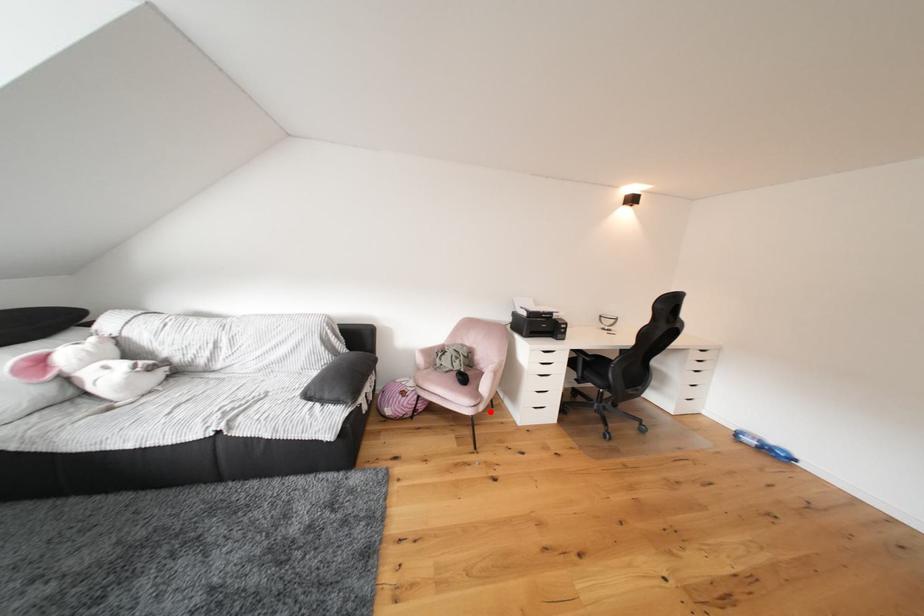
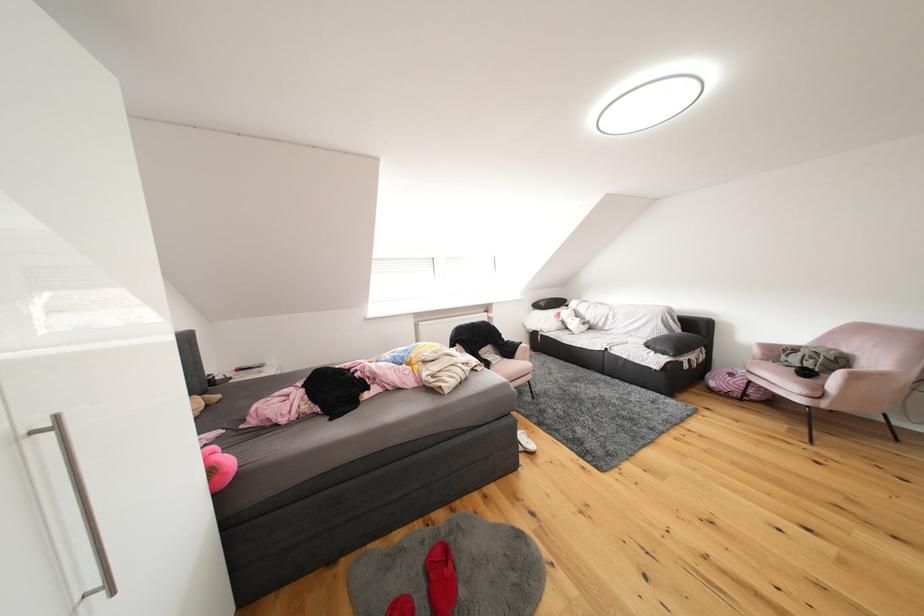
Question: I am providing you with two images of the same scene from different viewpoints. Image1 has a red point marked. In image2, the corresponding 3D location appears at what relative position? Reply with the corresponding letter.

Choices:
 (A) Closer
 (B) Farther

Answer: (A)